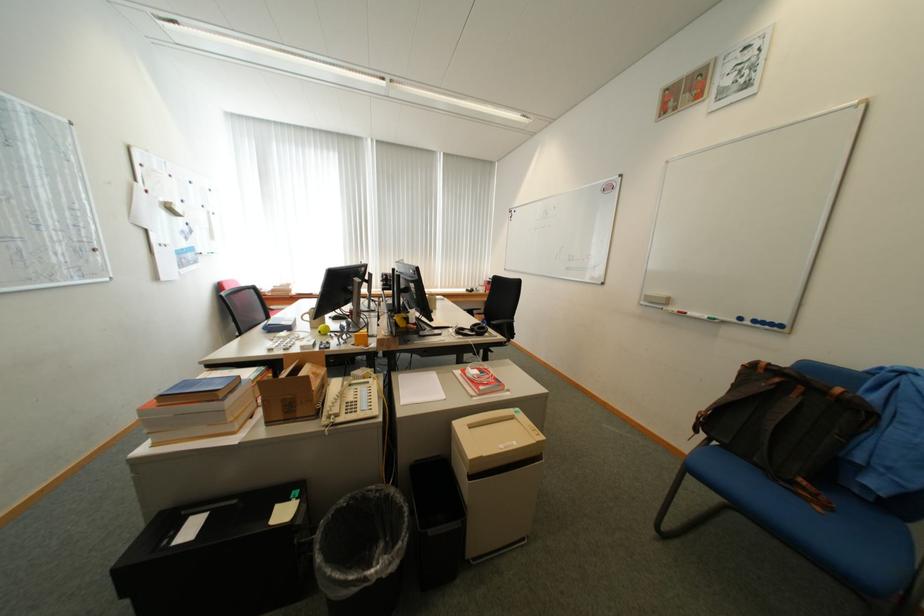
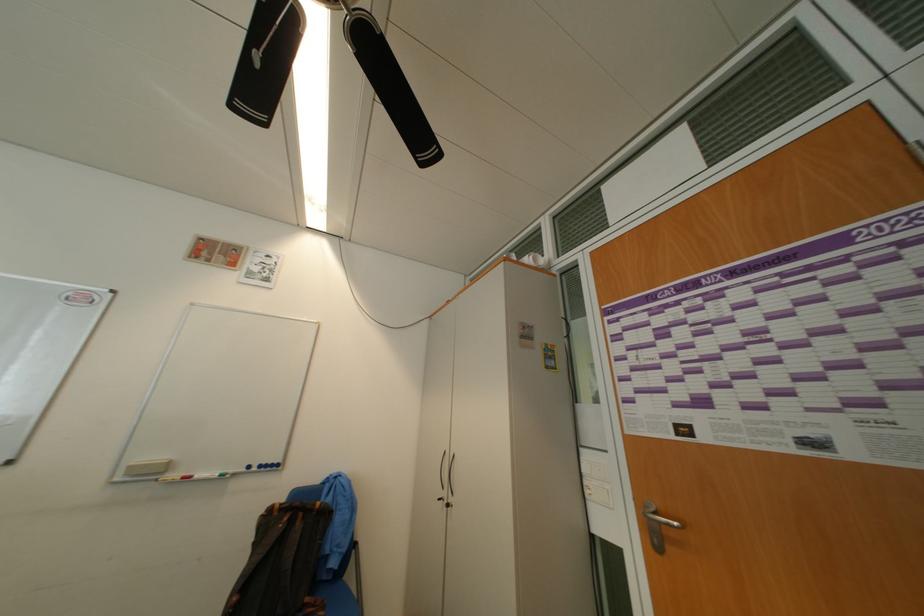
How did the camera likely rotate?

The camera's rotation is toward right-up.